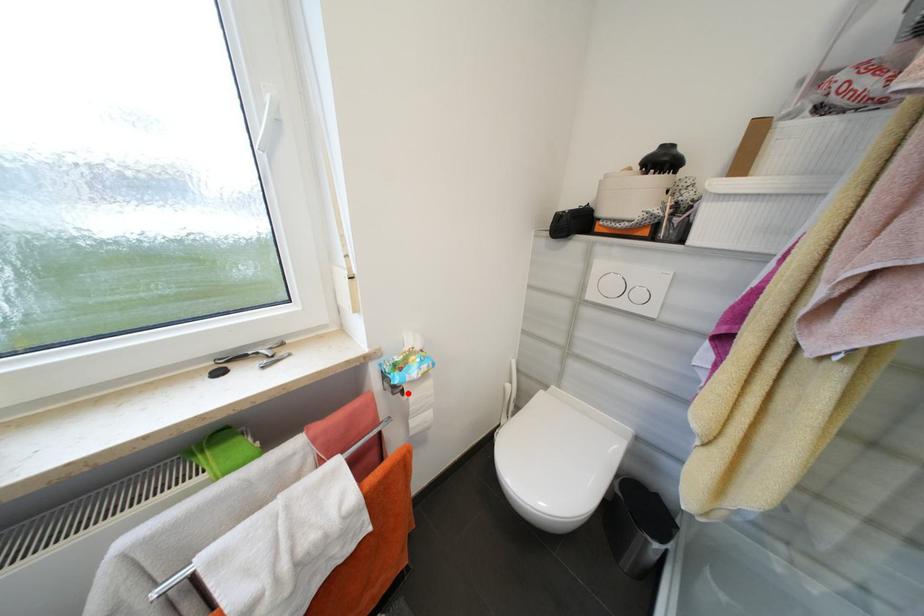
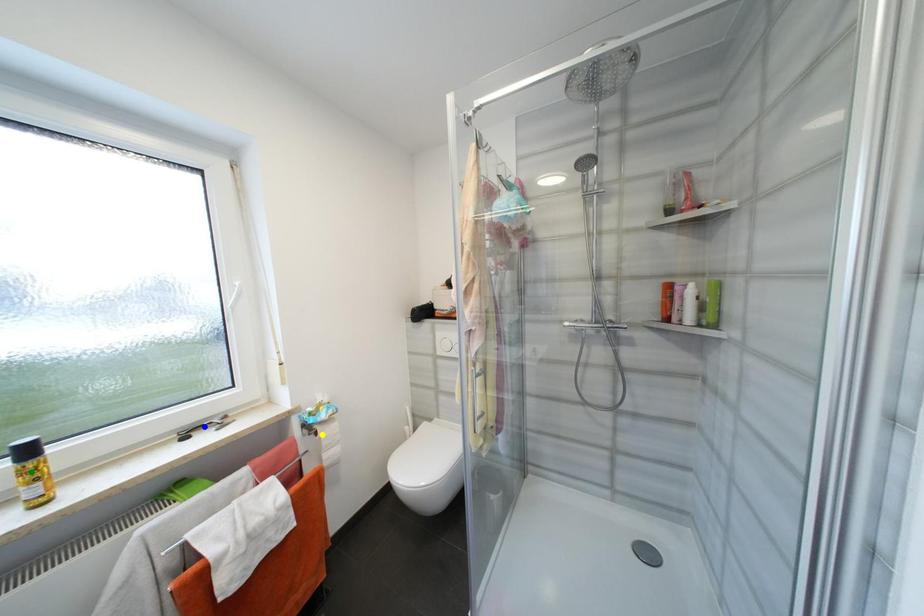
Question: I am providing you with two images of the same scene from different viewpoints. A red point is marked on the first image. You are given multiple points on the second image. Which spot in image 2 lines up with the point in image 1?

Choices:
 (A) blue point
 (B) yellow point
 (C) green point

Answer: (B)